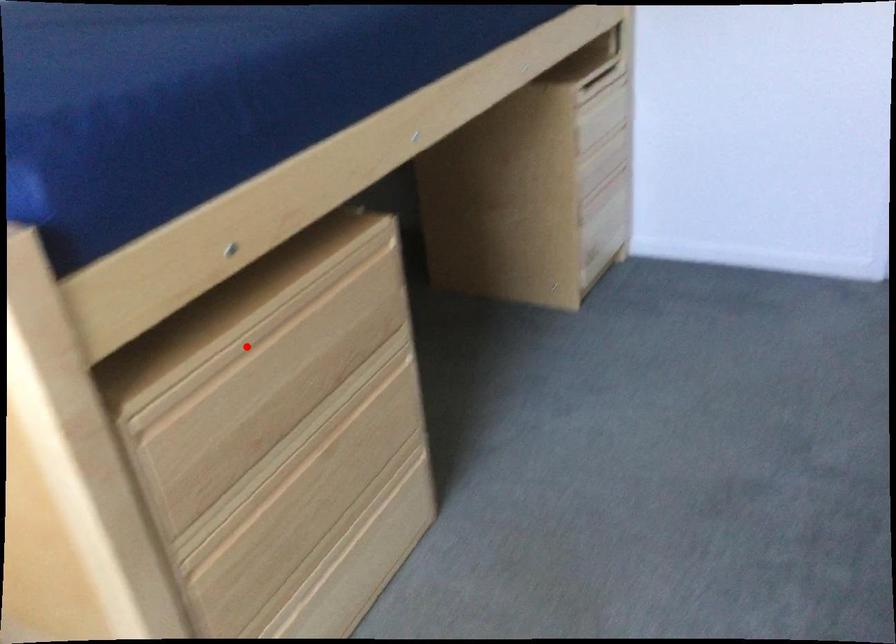
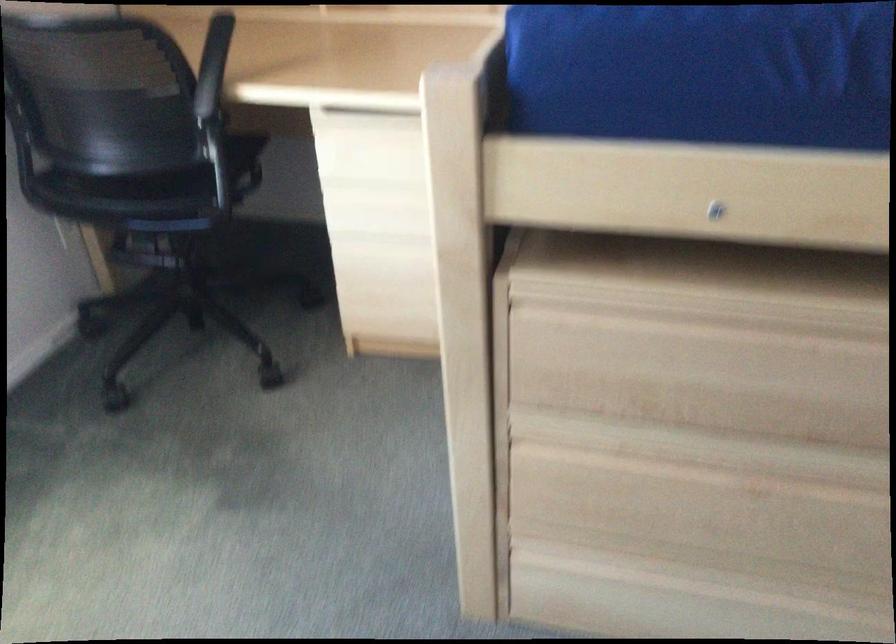
Question: I am providing you with two images of the same scene from different viewpoints. In image1, a red point is highlighted. Considering the same 3D point in image2, which of the following is correct?

Choices:
 (A) It is closer
 (B) It is farther

Answer: (A)